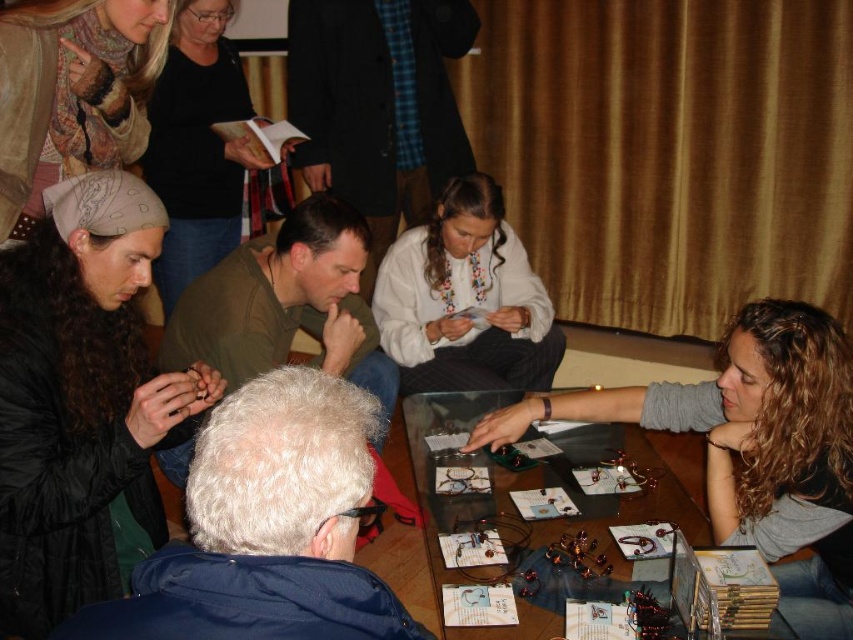
You are a photographer taking a photo of the scene. You notice a point at coordinates (82, 401). What object is located at that point?

The point at coordinates (82, 401) marks the location of the matte black hair at upper left.

You are a participant at the craft event and want to place your craft materials on the transparent glass table at center. However, you notice the black fabric shirt at upper center is in the way. Can you still place your materials on the table without moving the shirt?

The transparent glass table at center has a lesser height compared to black fabric shirt at upper center, so the shirt is taller than the table. This means the shirt might be hanging over the table, potentially blocking access to part of the table. You may need to adjust the shirt or find an unobstructed area on the table to place your materials.